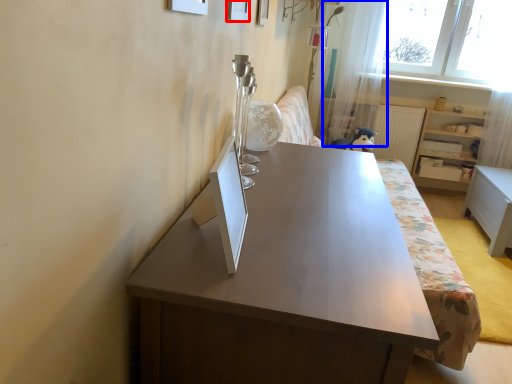
Question: Which object is further to the camera taking this photo, picture frame (highlighted by a red box) or curtain (highlighted by a blue box)?

Choices:
 (A) picture frame
 (B) curtain

Answer: (B)